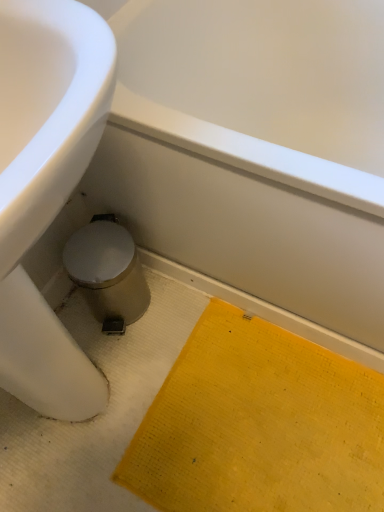
At what (x,y) coordinates should I click in order to perform the action: click on free spot above yellow textured mat at lower right (from a real-world perspective). Please return your answer as a coordinate pair (x, y). Looking at the image, I should click on (259, 440).